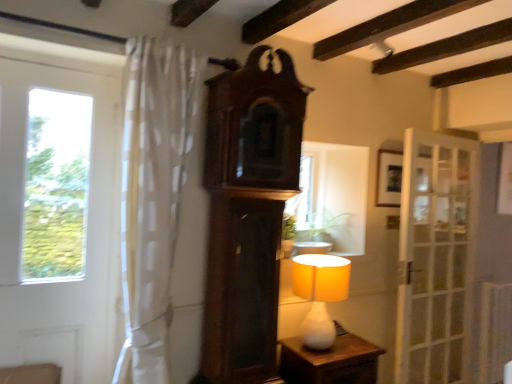
Find the location of a particular element. dark wood clock at center is located at coordinates (248, 213).

This screenshot has width=512, height=384. What do you see at coordinates (320, 294) in the screenshot?
I see `white matte table lamp at center` at bounding box center [320, 294].

I want to click on white matte table lamp at center, so click(x=320, y=294).

Describe the element at coordinates (153, 195) in the screenshot. I see `white sheer curtain at left` at that location.

In order to face white sheer curtain at left, should I rotate leftwards or rightwards?

Rotate left and turn 12.732 degrees.

What do you see at coordinates (436, 258) in the screenshot?
I see `white glass door at right, which is counted as the first door, starting from the right` at bounding box center [436, 258].

In order to click on white glass door at right, the first door viewed from the back in this screenshot , I will do `click(436, 258)`.

The height and width of the screenshot is (384, 512). What do you see at coordinates (60, 221) in the screenshot?
I see `white glass door at left, placed as the 1th door when sorted from left to right` at bounding box center [60, 221].

The height and width of the screenshot is (384, 512). I want to click on wooden picture frame at upper right, so click(x=389, y=178).

Image resolution: width=512 pixels, height=384 pixels. In order to click on green leafy plant at center in this screenshot , I will do `click(314, 227)`.

Based on the photo, from the image's perspective, which object appears higher, white glass door at right, placed as the 2th door when sorted from left to right, or white sheer curtain at left?

white sheer curtain at left, from the image's perspective.

From the picture: Is white glass door at right, the first door viewed from the back, bigger or smaller than white sheer curtain at left?

In the image, white glass door at right, the first door viewed from the back, appears to be smaller than white sheer curtain at left.

Looking at this image, is white glass door at right, placed as the 2th door when sorted from left to right, positioned in front of white sheer curtain at left?

That is False.

Does point (469, 198) lie in front of point (165, 45)?

No, it is not.

Can you confirm if white glass door at left, the second door positioned from the back, is positioned to the left of white glass door at right, which is counted as the first door, starting from the right?

Yes, white glass door at left, the second door positioned from the back, is to the left of white glass door at right, which is counted as the first door, starting from the right.

Is white glass door at left, the first door viewed from the front, outside of white glass door at right, the first door viewed from the back?

Absolutely, white glass door at left, the first door viewed from the front, is external to white glass door at right, the first door viewed from the back.

This screenshot has height=384, width=512. I want to click on door on the left of white glass door at right, which is counted as the first door, starting from the right, so click(x=60, y=221).

Could you measure the distance between white glass door at left, the first door viewed from the front, and white glass door at right, placed as the 2th door when sorted from left to right?

white glass door at left, the first door viewed from the front, and white glass door at right, placed as the 2th door when sorted from left to right, are 7.11 feet apart.

Can you confirm if white glass door at left, arranged as the 2th door when viewed from the right, is wider than green leafy plant at center?

In fact, white glass door at left, arranged as the 2th door when viewed from the right, might be narrower than green leafy plant at center.

From the image's perspective, who appears lower, white glass door at left, the second door positioned from the back, or green leafy plant at center?

green leafy plant at center appears lower in the image.

Is white sheer curtain at left not near white glass door at left, placed as the 1th door when sorted from left to right?

No, white sheer curtain at left is not far from white glass door at left, placed as the 1th door when sorted from left to right.

Consider the image. Looking at their sizes, would you say white sheer curtain at left is wider or thinner than white glass door at left, arranged as the 2th door when viewed from the right?

In the image, white sheer curtain at left appears to be wider than white glass door at left, arranged as the 2th door when viewed from the right.

Which is behind, white sheer curtain at left or white glass door at left, arranged as the 2th door when viewed from the right?

white glass door at left, arranged as the 2th door when viewed from the right.

Is white sheer curtain at left positioned with its back to white glass door at left, arranged as the 2th door when viewed from the right?

That's not correct — white sheer curtain at left is not looking away from white glass door at left, arranged as the 2th door when viewed from the right.

Considering the relative positions of white sheer curtain at left and green leafy plant at center in the image provided, is white sheer curtain at left to the left of green leafy plant at center from the viewer's perspective?

Yes.

Which is correct: white sheer curtain at left is inside green leafy plant at center, or outside of it?

white sheer curtain at left is outside green leafy plant at center.

Locate an element on the screen. The height and width of the screenshot is (384, 512). plant located on the right of white sheer curtain at left is located at coordinates (314, 227).

Considering the positions of objects white glass door at right, the first door viewed from the back, and white glass door at left, the second door positioned from the back, in the image provided, who is more to the left, white glass door at right, the first door viewed from the back, or white glass door at left, the second door positioned from the back,?

Positioned to the left is white glass door at left, the second door positioned from the back.

Is white glass door at right, placed as the 2th door when sorted from left to right, situated inside white glass door at left, arranged as the 2th door when viewed from the right, or outside?

white glass door at right, placed as the 2th door when sorted from left to right, is not inside white glass door at left, arranged as the 2th door when viewed from the right, it's outside.

From a real-world perspective, is white glass door at right, which is the second door from front to back, positioned under white glass door at left, the first door viewed from the front, based on gravity?

Indeed, from a real-world perspective, white glass door at right, which is the second door from front to back, is positioned beneath white glass door at left, the first door viewed from the front.

Which object is closer to the camera taking this photo, white sheer curtain at left or white glass door at right, which is counted as the first door, starting from the right?

white sheer curtain at left is more forward.

Which is in front, point (145, 114) or point (462, 164)?

The point (145, 114) is in front.

Are white sheer curtain at left and white glass door at right, which is counted as the first door, starting from the right, far apart?

white sheer curtain at left is far away from white glass door at right, which is counted as the first door, starting from the right.

Which of these two, white sheer curtain at left or white glass door at right, which is counted as the first door, starting from the right, is wider?

With larger width is white sheer curtain at left.

You are a GUI agent. You are given a task and a screenshot of the screen. Output one action in this format:
    pyautogui.click(x=<x>, y=<y>)
    Task: Click on the door to the right of white sheer curtain at left
    Image resolution: width=512 pixels, height=384 pixels.
    Given the screenshot: What is the action you would take?
    pyautogui.click(x=436, y=258)

Image resolution: width=512 pixels, height=384 pixels. I want to click on door that is under the white glass door at left, placed as the 1th door when sorted from left to right (from a real-world perspective), so click(x=436, y=258).

When comparing their distances from white glass door at left, arranged as the 2th door when viewed from the right, does white glass door at right, which is counted as the first door, starting from the right, or green leafy plant at center seem further?

white glass door at right, which is counted as the first door, starting from the right.

Based on their spatial positions, is white matte table lamp at center or white glass door at right, which is counted as the first door, starting from the right, closer to white glass door at left, the first door viewed from the front?

white matte table lamp at center.

Which object lies nearer to the anchor point white glossy nightstand at lower center, dark wood clock at center or green leafy plant at center?

dark wood clock at center is positioned closer to the anchor white glossy nightstand at lower center.

Looking at the image, which one is located further to white sheer curtain at left, green leafy plant at center or white glossy nightstand at lower center?

Among the two, green leafy plant at center is located further to white sheer curtain at left.

Looking at the image, which one is located closer to white glass door at right, which is the second door from front to back, green leafy plant at center or wooden picture frame at upper right?

Among the two, wooden picture frame at upper right is located nearer to white glass door at right, which is the second door from front to back.

Which object lies further to the anchor point white glossy nightstand at lower center, white glass door at right, placed as the 2th door when sorted from left to right, or dark wood clock at center?

Based on the image, white glass door at right, placed as the 2th door when sorted from left to right, appears to be further to white glossy nightstand at lower center.

Based on their spatial positions, is white glass door at left, the first door viewed from the front, or white glossy nightstand at lower center further from white matte table lamp at center?

Among the two, white glass door at left, the first door viewed from the front, is located further to white matte table lamp at center.

From the image, which object appears to be farther from white glass door at right, the first door viewed from the back, white matte table lamp at center or green leafy plant at center?

white matte table lamp at center lies further to white glass door at right, the first door viewed from the back, than the other object.

Locate an element on the screen. The height and width of the screenshot is (384, 512). nightstand between white sheer curtain at left and green leafy plant at center is located at coordinates (330, 361).

Image resolution: width=512 pixels, height=384 pixels. What are the coordinates of `picture frame between green leafy plant at center and white glass door at right, which is the second door from front to back, in the horizontal direction` in the screenshot? It's located at (389, 178).

Identify the location of picture frame between white sheer curtain at left and white glass door at right, which is counted as the first door, starting from the right, from left to right. The width and height of the screenshot is (512, 384). (389, 178).

The width and height of the screenshot is (512, 384). I want to click on clock between white sheer curtain at left and white matte table lamp at center in the horizontal direction, so click(x=248, y=213).